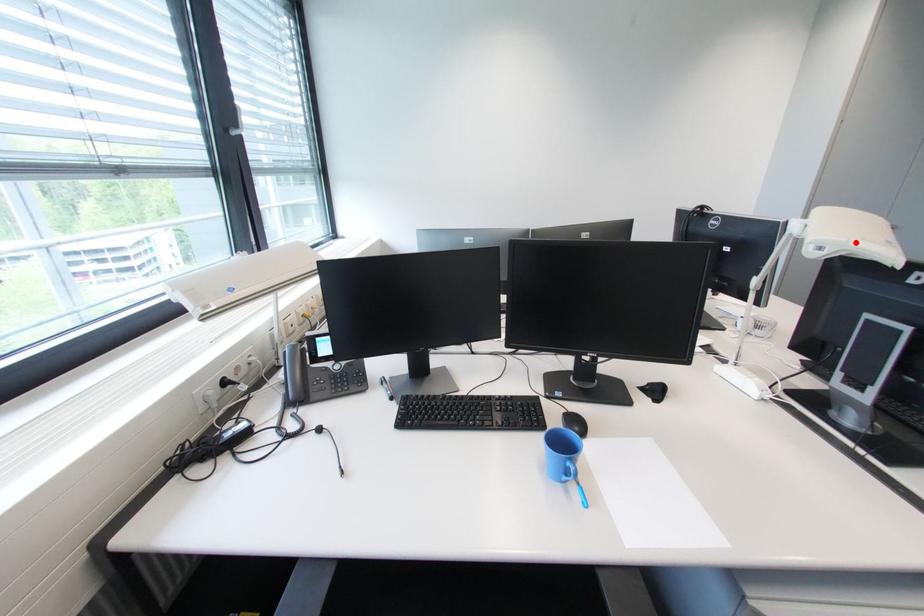
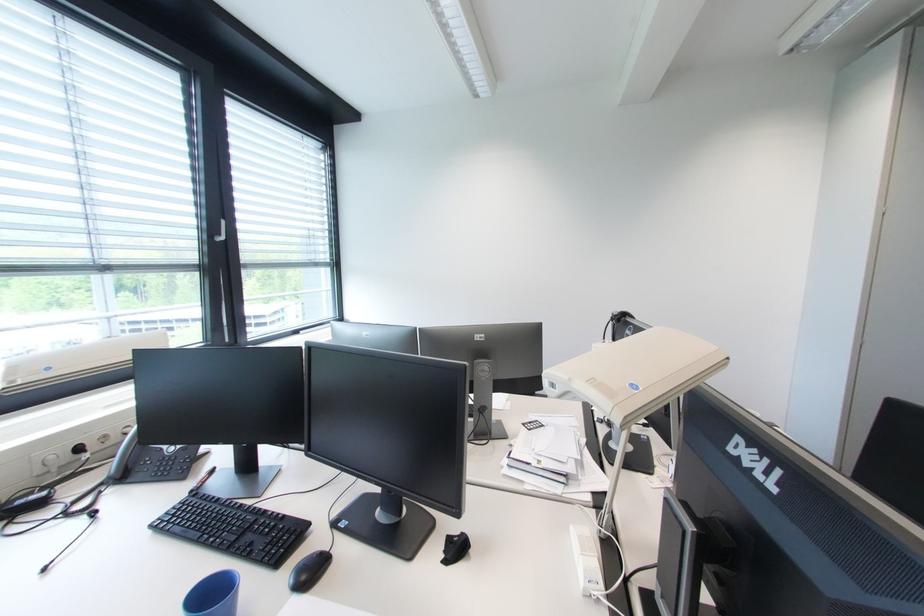
Question: I am providing you with two images of the same scene from different viewpoints. In image1, a red point is highlighted. Considering the same 3D point in image2, which of the following is correct?

Choices:
 (A) It is closer
 (B) It is farther

Answer: (B)